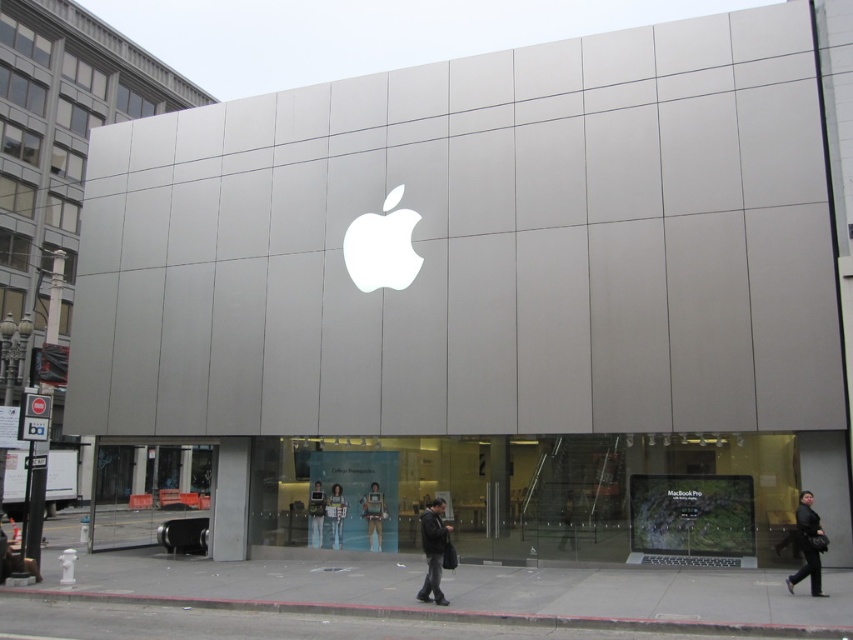
This screenshot has height=640, width=853. What do you see at coordinates (433, 550) in the screenshot?
I see `dark gray jacket at center` at bounding box center [433, 550].

Can you confirm if dark gray jacket at center is positioned below matte black suit at center?

Incorrect, dark gray jacket at center is not positioned below matte black suit at center.

Does point (438, 534) come closer to viewer compared to point (318, 518)?

Yes.

Identify the location of dark gray jacket at center. This screenshot has width=853, height=640. (433, 550).

Who is more distant from viewer, [434,570] or [380,528]?

The point [380,528] is more distant.

Is dark gray jacket at center to the right of metallic silver suit at center from the viewer's perspective?

Indeed, dark gray jacket at center is positioned on the right side of metallic silver suit at center.

Which is behind, point (421, 531) or point (379, 515)?

The point (379, 515) is behind.

The image size is (853, 640). Find the location of `dark gray jacket at center`. dark gray jacket at center is located at coordinates (433, 550).

Between metallic silver suit at center and matte black suit at center, which one appears on the right side from the viewer's perspective?

metallic silver suit at center is more to the right.

Does metallic silver suit at center have a smaller size compared to matte black suit at center?

Incorrect, metallic silver suit at center is not smaller in size than matte black suit at center.

Where is `metallic silver suit at center`? This screenshot has width=853, height=640. metallic silver suit at center is located at coordinates tap(373, 515).